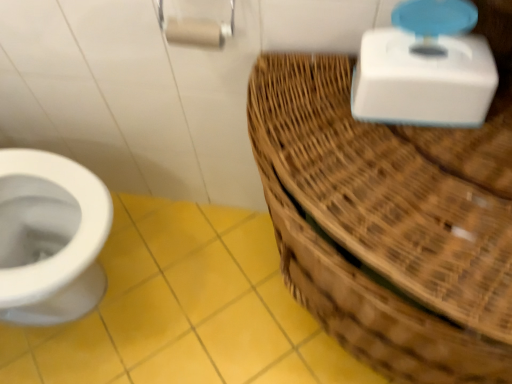
What is the approximate width of matte white toilet paper at upper center?

The width of matte white toilet paper at upper center is 2.05 inches.

Find the location of a particular element. matte white toilet paper at upper center is located at coordinates (194, 32).

Does point (323, 246) appear closer or farther from the camera than point (199, 28)?

Point (323, 246) is positioned closer to the camera compared to point (199, 28).

From the image's perspective, is woven brown basket at right positioned above or below matte white toilet paper at upper center?

Based on their image positions, woven brown basket at right is located beneath matte white toilet paper at upper center.

Locate an element on the screen. The image size is (512, 384). basket on the right of matte white toilet paper at upper center is located at coordinates (388, 223).

Can you confirm if woven brown basket at right is thinner than matte white toilet paper at upper center?

In fact, woven brown basket at right might be wider than matte white toilet paper at upper center.

From the image's perspective, which is above, matte white toilet paper at upper center or yellow matte tile at lower left?

matte white toilet paper at upper center.

Is point (185, 34) positioned in front of point (224, 220)?

Yes.

Is matte white toilet paper at upper center spatially inside yellow matte tile at lower left, or outside of it?

matte white toilet paper at upper center is located beyond the bounds of yellow matte tile at lower left.

In the scene shown: From a real-world perspective, which object rests below the other?

From a 3D spatial view, yellow matte tile at lower left is below.

Consider the image. Is woven brown basket at right wider or thinner than yellow matte tile at lower left?

woven brown basket at right is thinner than yellow matte tile at lower left.

Is woven brown basket at right not near yellow matte tile at lower left?

No, woven brown basket at right is not far away from yellow matte tile at lower left.

Between point (304, 162) and point (170, 294), which one is positioned in front?

Positioned in front is point (304, 162).

Is white plastic scale at upper right closer to the viewer compared to woven brown basket at right?

No, white plastic scale at upper right is behind woven brown basket at right.

Where is `scale behind the woven brown basket at right`? This screenshot has width=512, height=384. scale behind the woven brown basket at right is located at coordinates (425, 68).

In terms of height, does white plastic scale at upper right look taller or shorter compared to woven brown basket at right?

In the image, white plastic scale at upper right appears to be shorter than woven brown basket at right.

In the scene shown: Is white plastic scale at upper right placed right next to woven brown basket at right?

No, white plastic scale at upper right is not in contact with woven brown basket at right.

Does matte white toilet paper at upper center turn towards woven brown basket at right?

No, matte white toilet paper at upper center is not oriented towards woven brown basket at right.

Does matte white toilet paper at upper center have a greater width compared to woven brown basket at right?

In fact, matte white toilet paper at upper center might be narrower than woven brown basket at right.

Which is correct: matte white toilet paper at upper center is inside woven brown basket at right, or outside of it?

matte white toilet paper at upper center is located beyond the bounds of woven brown basket at right.

Is point (453, 97) positioned behind point (214, 26)?

No, it is not.

This screenshot has width=512, height=384. In order to click on toilet paper behind the white plastic scale at upper right in this screenshot , I will do click(194, 32).

Does white plastic scale at upper right have a smaller size compared to matte white toilet paper at upper center?

Actually, white plastic scale at upper right might be larger than matte white toilet paper at upper center.

Choose the correct answer: Is white plastic scale at upper right inside matte white toilet paper at upper center or outside it?

white plastic scale at upper right is not enclosed by matte white toilet paper at upper center.

From the picture: In terms of size, does yellow matte tile at lower left appear bigger or smaller than matte white toilet paper at upper center?

In the image, yellow matte tile at lower left appears to be larger than matte white toilet paper at upper center.

Is yellow matte tile at lower left wider or thinner than matte white toilet paper at upper center?

Considering their sizes, yellow matte tile at lower left looks broader than matte white toilet paper at upper center.

Is matte white toilet paper at upper center completely or partially inside yellow matte tile at lower left?

No, matte white toilet paper at upper center is not a part of yellow matte tile at lower left.

Locate an element on the screen. The width and height of the screenshot is (512, 384). basket below the matte white toilet paper at upper center (from the image's perspective) is located at coordinates (388, 223).

At what (x,y) coordinates should I click in order to perform the action: click on toilet paper in front of the yellow matte tile at lower left. Please return your answer as a coordinate pair (x, y). The image size is (512, 384). Looking at the image, I should click on (194, 32).

From the image, which object appears to be farther from yellow matte tile at lower left, white plastic scale at upper right or matte white toilet paper at upper center?

white plastic scale at upper right lies further to yellow matte tile at lower left than the other object.

Estimate the real-world distances between objects in this image. Which object is closer to white plastic scale at upper right, yellow matte tile at lower left or woven brown basket at right?

woven brown basket at right is positioned closer to the anchor white plastic scale at upper right.

Which object lies further to the anchor point woven brown basket at right, matte white toilet paper at upper center or white plastic scale at upper right?

matte white toilet paper at upper center is further to woven brown basket at right.

Considering their positions, is yellow matte tile at lower left positioned further to matte white toilet paper at upper center than white plastic scale at upper right?

yellow matte tile at lower left lies further to matte white toilet paper at upper center than the other object.

Estimate the real-world distances between objects in this image. Which object is further from yellow matte tile at lower left, woven brown basket at right or matte white toilet paper at upper center?

Based on the image, matte white toilet paper at upper center appears to be further to yellow matte tile at lower left.

Considering their positions, is matte white toilet paper at upper center positioned further to woven brown basket at right than yellow matte tile at lower left?

yellow matte tile at lower left is positioned further to the anchor woven brown basket at right.

When comparing their distances from woven brown basket at right, does white plastic scale at upper right or yellow matte tile at lower left seem further?

yellow matte tile at lower left is positioned further to the anchor woven brown basket at right.

Based on the photo, estimate the real-world distances between objects in this image. Which object is further from yellow matte tile at lower left, woven brown basket at right or white plastic scale at upper right?

white plastic scale at upper right is further to yellow matte tile at lower left.

Locate an element on the screen. The image size is (512, 384). scale that lies between matte white toilet paper at upper center and yellow matte tile at lower left from top to bottom is located at coordinates (425, 68).

Image resolution: width=512 pixels, height=384 pixels. I want to click on basket that lies between matte white toilet paper at upper center and yellow matte tile at lower left from top to bottom, so tap(388, 223).

Locate an element on the screen. The height and width of the screenshot is (384, 512). scale between matte white toilet paper at upper center and woven brown basket at right from top to bottom is located at coordinates (425, 68).

This screenshot has width=512, height=384. I want to click on scale between woven brown basket at right and yellow matte tile at lower left in the front-back direction, so click(x=425, y=68).